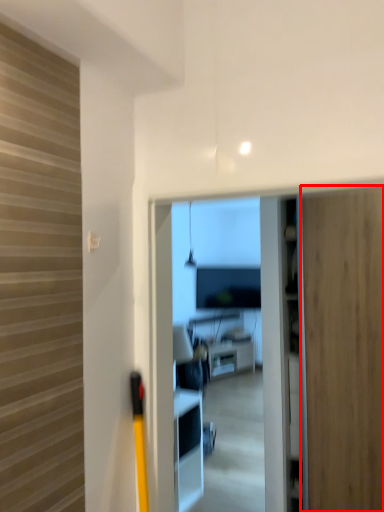
Question: Considering the relative positions of door (annotated by the red box) and furniture in the image provided, where is door (annotated by the red box) located with respect to the staircase?

Choices:
 (A) left
 (B) right

Answer: (B)